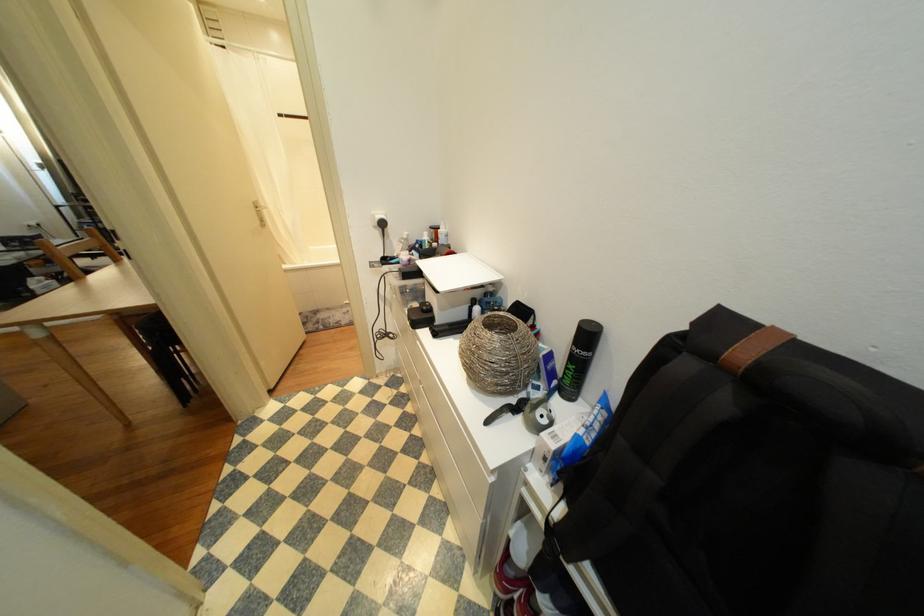
At what (x,y) coordinates should I click in order to perform the action: click on white drawer pull. Please return your answer as a coordinate pair (x, y). Looking at the image, I should click on (347, 330).